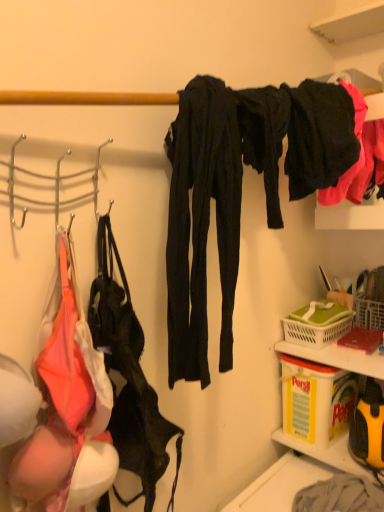
Question: From a real-world perspective, does leather-like black handbag at left sit lower than black matte pants at upper right, the first clothing from the right?

Choices:
 (A) no
 (B) yes

Answer: (B)

Question: Does leather-like black handbag at left have a greater width compared to black matte pants at upper right, the first clothing from the right?

Choices:
 (A) yes
 (B) no

Answer: (B)

Question: Is leather-like black handbag at left not near black matte pants at upper right, the first clothing from the right?

Choices:
 (A) yes
 (B) no

Answer: (B)

Question: Is leather-like black handbag at left shorter than black matte pants at upper right, the second clothing from the left?

Choices:
 (A) yes
 (B) no

Answer: (B)

Question: Is leather-like black handbag at left facing towards black matte pants at upper right, the first clothing from the right?

Choices:
 (A) yes
 (B) no

Answer: (B)

Question: Does leather-like black handbag at left come behind black matte pants at upper right, the first clothing from the right?

Choices:
 (A) yes
 (B) no

Answer: (B)

Question: Considering the relative sizes of yellow plastic container at lower right and black matte pants at upper right, the first clothing from the right, in the image provided, is yellow plastic container at lower right bigger than black matte pants at upper right, the first clothing from the right,?

Choices:
 (A) yes
 (B) no

Answer: (B)

Question: From the image's perspective, is yellow plastic container at lower right on black matte pants at upper right, the first clothing from the right?

Choices:
 (A) no
 (B) yes

Answer: (A)

Question: From a real-world perspective, is yellow plastic container at lower right below black matte pants at upper right, the second clothing from the left?

Choices:
 (A) yes
 (B) no

Answer: (A)

Question: Is yellow plastic container at lower right further to the viewer compared to black matte pants at upper right, the first clothing from the right?

Choices:
 (A) no
 (B) yes

Answer: (B)

Question: Is yellow plastic container at lower right outside black matte pants at upper right, the first clothing from the right?

Choices:
 (A) yes
 (B) no

Answer: (A)

Question: Would you say yellow plastic container at lower right is a long distance from black matte pants at upper right, the first clothing from the right?

Choices:
 (A) yes
 (B) no

Answer: (B)

Question: Are black matte pants at upper right, the second clothing from the left, and leather-like black handbag at left located far from each other?

Choices:
 (A) no
 (B) yes

Answer: (A)